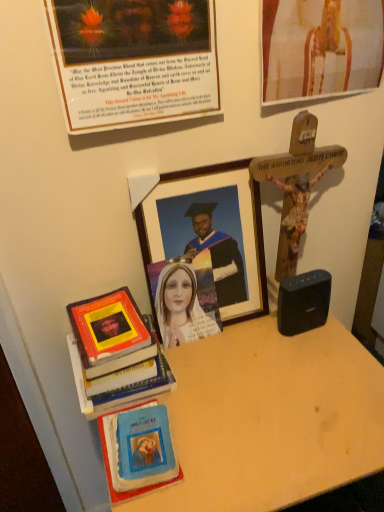
This screenshot has width=384, height=512. I want to click on vacant space situated on the left part of black plastic speaker at right, so click(242, 345).